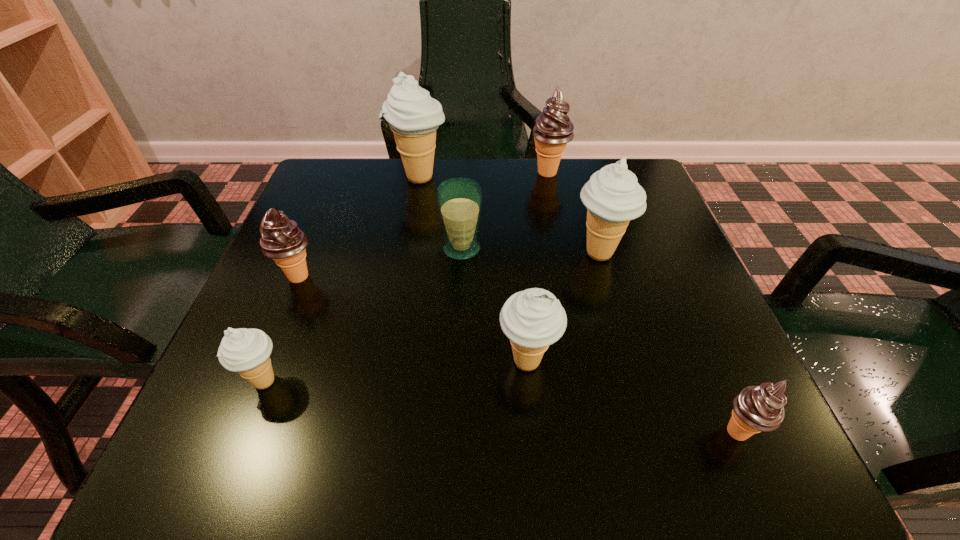
This screenshot has width=960, height=540. Find the location of `the biggest beige icecream`. the biggest beige icecream is located at coordinates (413, 116).

Image resolution: width=960 pixels, height=540 pixels. Find the location of `the third icecream from left to right`. the third icecream from left to right is located at coordinates (413, 116).

Identify the location of the second chocolate icecream from left to right. This screenshot has width=960, height=540. (553, 129).

The height and width of the screenshot is (540, 960). Identify the location of the biggest chocolate icecream. (553, 129).

The width and height of the screenshot is (960, 540). I want to click on the second farthest beige icecream, so click(x=613, y=197).

Locate an element on the screen. The image size is (960, 540). the second biggest beige icecream is located at coordinates (613, 197).

You are a GUI agent. You are given a task and a screenshot of the screen. Output one action in this format:
    pyautogui.click(x=<x>, y=<y>)
    Task: Click on the second farthest chocolate icecream
    This screenshot has width=960, height=540.
    Given the screenshot: What is the action you would take?
    pyautogui.click(x=281, y=239)

You are a GUI agent. You are given a task and a screenshot of the screen. Output one action in this format:
    pyautogui.click(x=<x>, y=<y>)
    Task: Click on the leftmost chocolate icecream
    The height and width of the screenshot is (540, 960).
    Given the screenshot: What is the action you would take?
    pyautogui.click(x=281, y=239)

At what (x,y) coordinates should I click in order to perform the action: click on the third beige icecream from left to right. Please return your answer as a coordinate pair (x, y). Looking at the image, I should click on (533, 319).

Where is `glass`? glass is located at coordinates (459, 200).